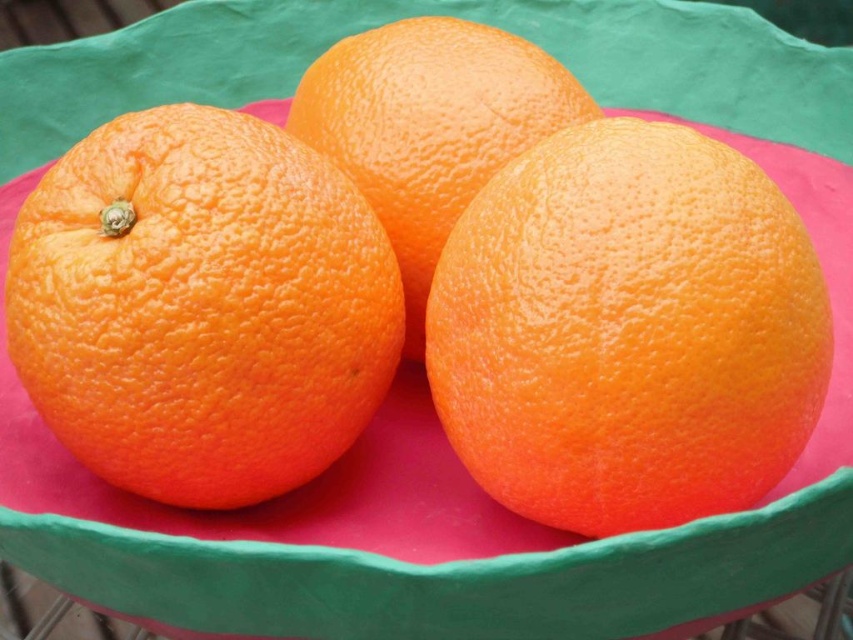
Question: Can you confirm if orangesmoothorange at center is positioned above orangetexturedorange at left?

Choices:
 (A) yes
 (B) no

Answer: (B)

Question: Which is farther from the orangetexturedorange at center?

Choices:
 (A) orangetexturedorange at left
 (B) orangesmoothorange at center

Answer: (B)

Question: Which object is positioned farthest from the orangesmoothorange at center?

Choices:
 (A) orangetexturedorange at center
 (B) orangetexturedorange at left

Answer: (B)

Question: Is orangesmoothorange at center wider than orangetexturedorange at center?

Choices:
 (A) yes
 (B) no

Answer: (A)

Question: Is orangetexturedorange at left thinner than orangetexturedorange at center?

Choices:
 (A) no
 (B) yes

Answer: (A)

Question: Which point appears closest to the camera in this image?

Choices:
 (A) (42, 282)
 (B) (392, 120)
 (C) (572, 168)

Answer: (A)